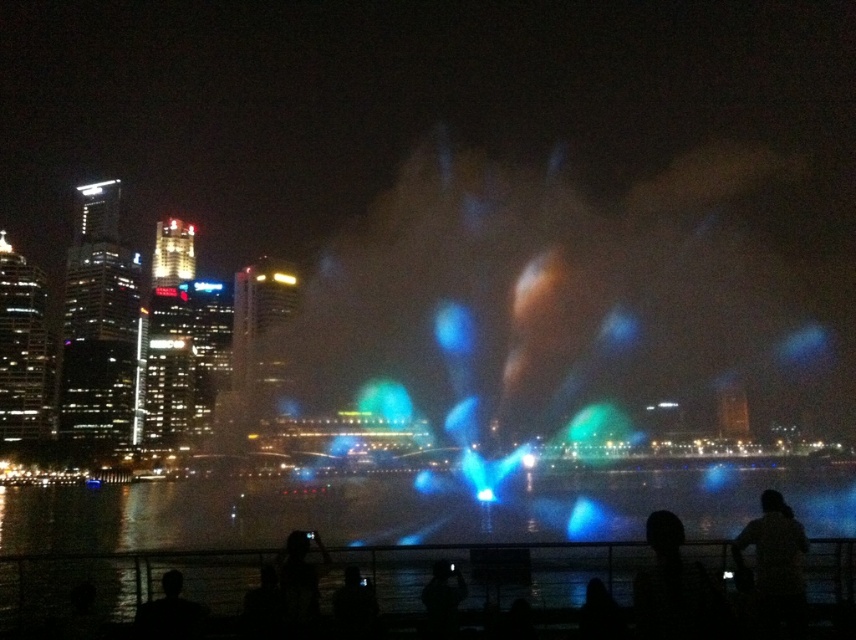
Question: Is dark fabric shirt at lower right smaller than silhouette skin at lower left?

Choices:
 (A) no
 (B) yes

Answer: (A)

Question: Is transparent liquid water at center positioned at the back of silhouette hair at center?

Choices:
 (A) yes
 (B) no

Answer: (A)

Question: Can you confirm if transparent liquid water at center is positioned to the left of dark fabric shirt at lower right?

Choices:
 (A) yes
 (B) no

Answer: (A)

Question: Which point is farther from the camera taking this photo?

Choices:
 (A) (657, 593)
 (B) (164, 577)
 (C) (611, 544)
 (D) (750, 531)

Answer: (C)

Question: Which object is closer to the camera taking this photo?

Choices:
 (A) dark fabric shirt at lower right
 (B) silhouette skin at lower left

Answer: (A)

Question: Estimate the real-world distances between objects in this image. Which object is closer to the transparent liquid water at center?

Choices:
 (A) silhouette hair at center
 (B) dark fabric shirt at lower right

Answer: (A)